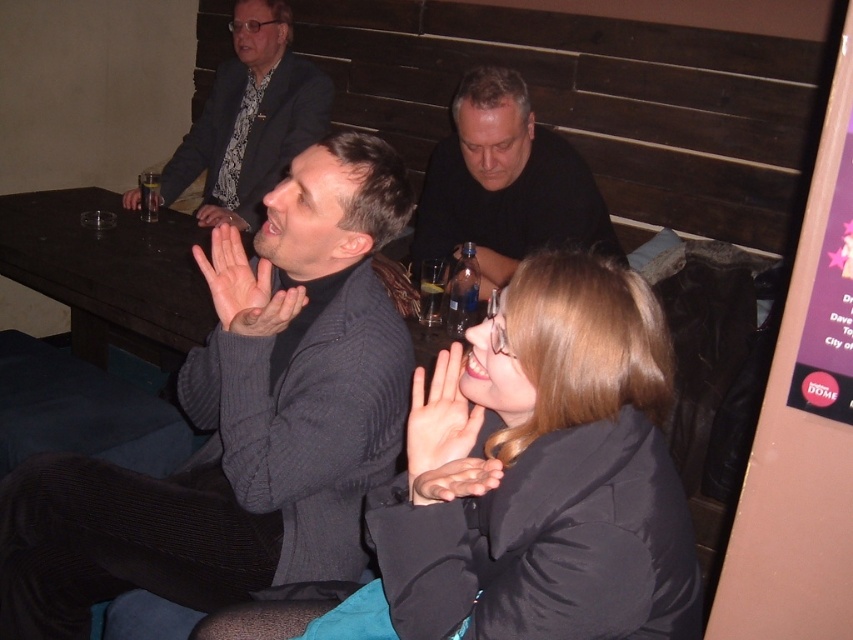
Is dark gray sweater at center to the left of black matte jacket at center from the viewer's perspective?

Yes, dark gray sweater at center is to the left of black matte jacket at center.

Describe the element at coordinates (242, 419) in the screenshot. I see `dark gray sweater at center` at that location.

Is point (355, 342) farther from camera compared to point (614, 284)?

Yes, it is.

You are a GUI agent. You are given a task and a screenshot of the screen. Output one action in this format:
    pyautogui.click(x=<x>, y=<y>)
    Task: Click on the dark gray sweater at center
    This screenshot has height=640, width=853.
    Given the screenshot: What is the action you would take?
    pyautogui.click(x=242, y=419)

In the scene shown: Does dark gray sweater at center lie in front of dark wood table at center?

Yes, it is in front of dark wood table at center.

Can you confirm if dark gray sweater at center is positioned above dark wood table at center?

Incorrect, dark gray sweater at center is not positioned above dark wood table at center.

Who is more distant from viewer, (213, 595) or (91, 326)?

The point (91, 326) is behind.

I want to click on dark gray sweater at center, so click(242, 419).

Can you confirm if dark gray sweater at center is bigger than black matte shirt at center?

Indeed, dark gray sweater at center has a larger size compared to black matte shirt at center.

Does dark gray sweater at center appear on the right side of black matte shirt at center?

No, dark gray sweater at center is not to the right of black matte shirt at center.

The height and width of the screenshot is (640, 853). What do you see at coordinates (242, 419) in the screenshot? I see `dark gray sweater at center` at bounding box center [242, 419].

Identify the location of dark gray sweater at center. This screenshot has height=640, width=853. (242, 419).